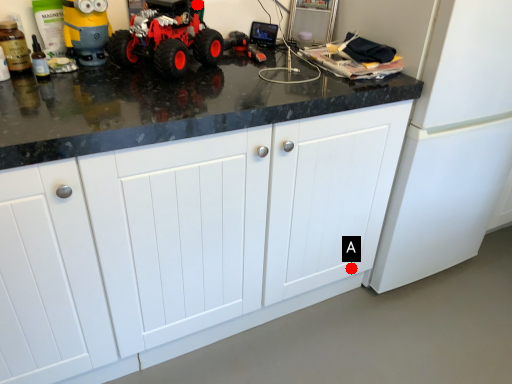
Question: Two points are circled on the image, labeled by A and B beside each circle. Among these points, which one is nearest to the camera?

Choices:
 (A) A is closer
 (B) B is closer

Answer: (B)